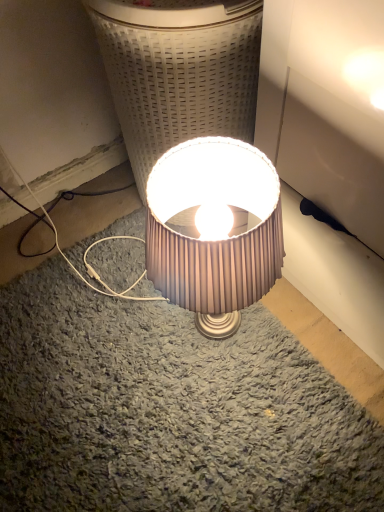
The image size is (384, 512). What do you see at coordinates (179, 71) in the screenshot?
I see `white woven laundry basket at center` at bounding box center [179, 71].

The height and width of the screenshot is (512, 384). Find the location of `white woven laundry basket at center`. white woven laundry basket at center is located at coordinates (179, 71).

This screenshot has height=512, width=384. I want to click on white woven laundry basket at center, so click(x=179, y=71).